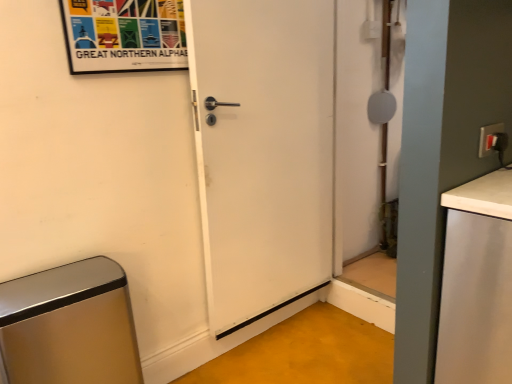
Image resolution: width=512 pixels, height=384 pixels. In order to click on free space in front of matte white switch at upper right in this screenshot , I will do `click(492, 177)`.